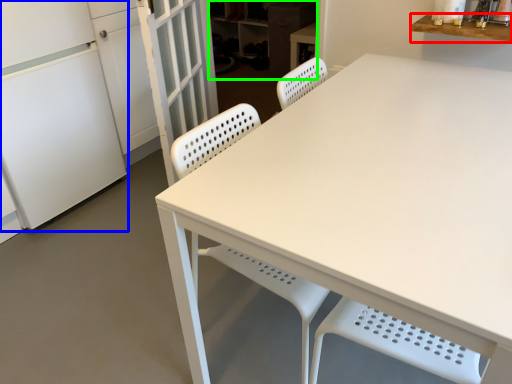
Question: Considering the real-world distances, which object is farthest from counter top (highlighted by a red box)? fridge (highlighted by a blue box) or cabinetry (highlighted by a green box)?

Choices:
 (A) fridge
 (B) cabinetry

Answer: (B)